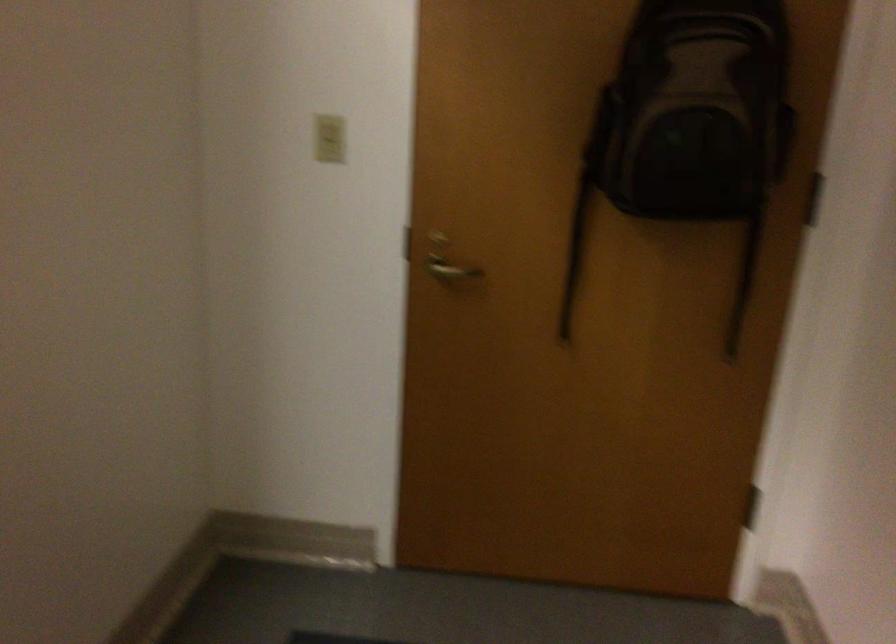
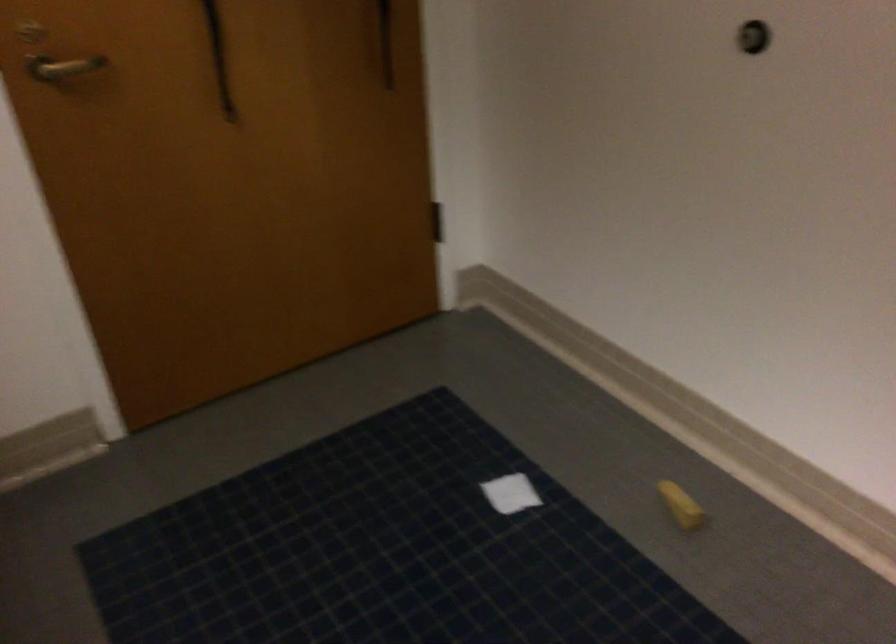
The images are taken continuously from a first-person perspective. In which direction is your viewpoint rotating?

The camera's rotation is toward right-down.